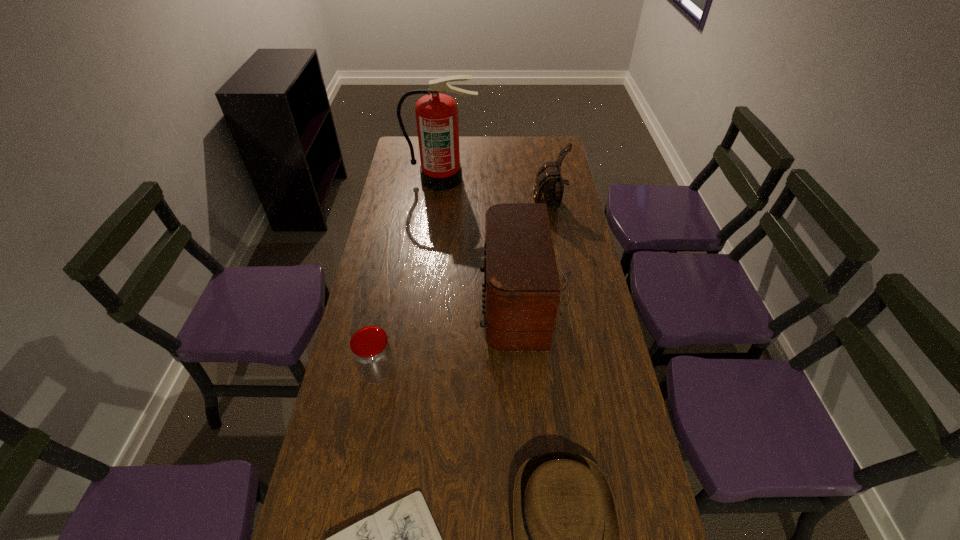
Locate an element on the screen. free spot at the far right corner of the desktop is located at coordinates pos(533,147).

This screenshot has height=540, width=960. What are the coordinates of `object that is the second closest to the fourth shortest object` in the screenshot? It's located at (521, 293).

Select which object appears as the closest to the jar. Please provide its 2D coordinates. Your answer should be formatted as a tuple, i.e. [(x, y)], where the tuple contains the x and y coordinates of a point satisfying the conditions above.

[(521, 293)]

Image resolution: width=960 pixels, height=540 pixels. What are the coordinates of `vacant space that satisfies the following two spatial constraints: 1. on the front panel of the radio receiver; 2. on the front side of the jar` in the screenshot? It's located at (536, 372).